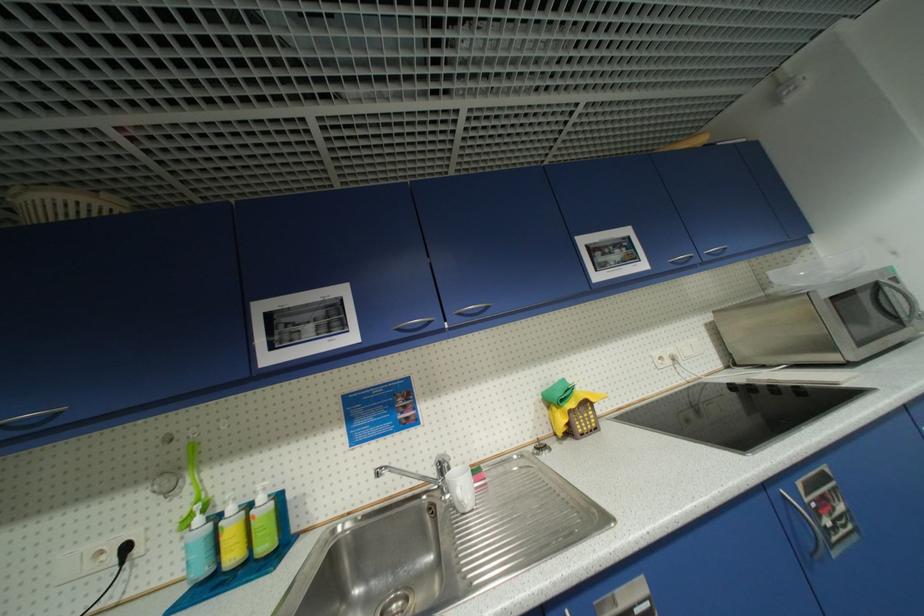
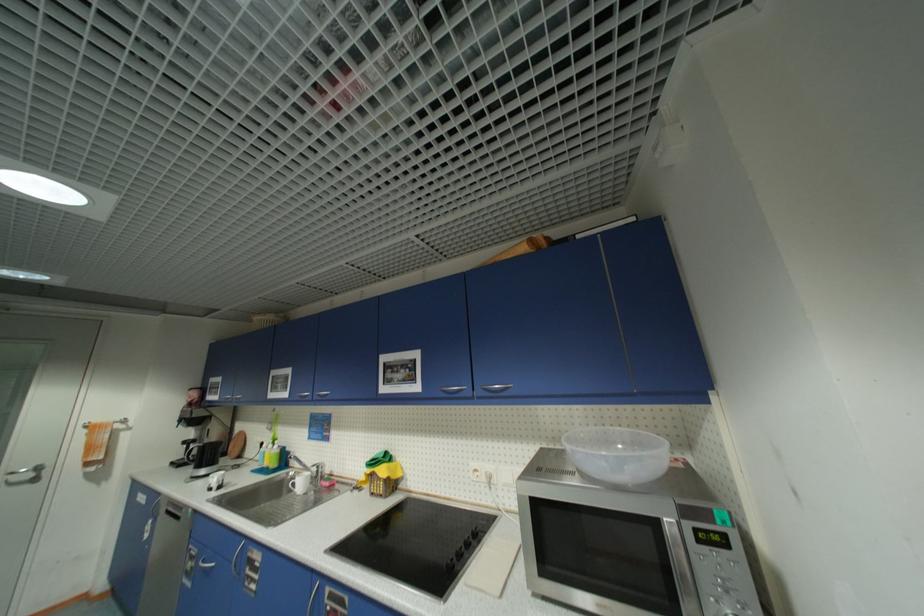
The point at [466,315] is marked in the first image. Where is the corresponding point in the second image?

(323, 395)